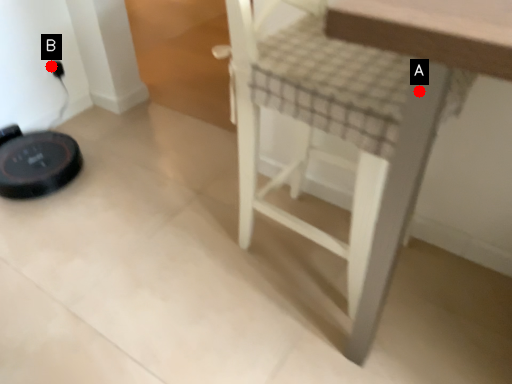
Question: Two points are circled on the image, labeled by A and B beside each circle. Which of the following is the farthest from the observer?

Choices:
 (A) A is further
 (B) B is further

Answer: (B)